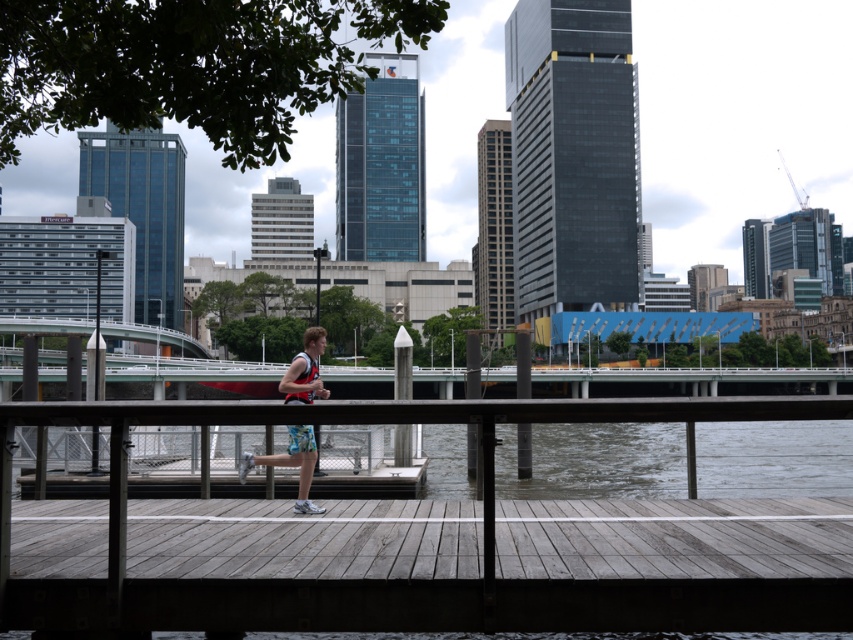
You are a photographer standing at the riverside. You see the wooden dock at center and the floral shorts at center. Which object is closer to you?

The wooden dock at center is closer to you because it is in front of the floral shorts at center.

You are a photographer aiming to capture a runner on the wooden dock at center and floral shorts at center. Which object should you focus on first if you want to highlight the runner in motion?

The wooden dock at center is positioned on the right side of floral shorts at center, so focusing on the floral shorts at center first would place the runner closer to the center of the image for better emphasis.